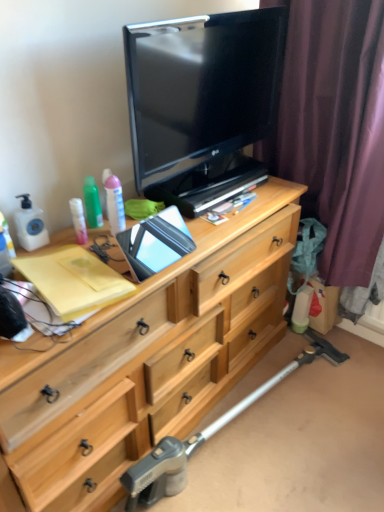
You are a GUI agent. You are given a task and a screenshot of the screen. Output one action in this format:
    pyautogui.click(x=<x>, y=<y>)
    Task: Click on the blank space situated above light wood chest of drawers at center (from a real-world perspective)
    The height and width of the screenshot is (512, 384).
    Given the screenshot: What is the action you would take?
    click(x=160, y=263)